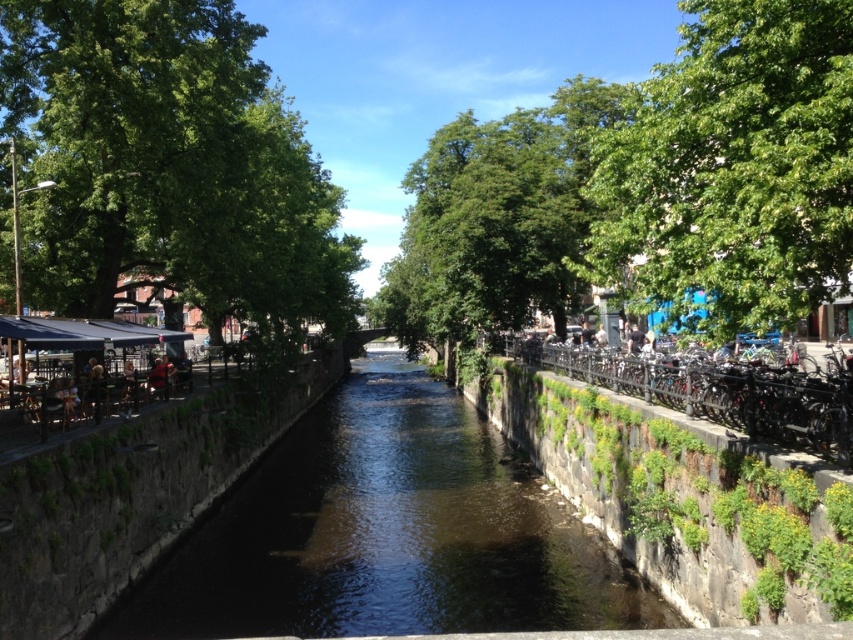
Which is more to the left, green leafy tree at left or green leafy tree at upper right?

green leafy tree at left is more to the left.

Is point (91, 106) positioned in front of point (616, 192)?

No, it is behind (616, 192).

Where is `green leafy tree at left`? Image resolution: width=853 pixels, height=640 pixels. green leafy tree at left is located at coordinates (167, 164).

Who is more forward, (444,572) or (616,262)?

Point (616,262)

Which is in front, point (167, 570) or point (804, 230)?

Point (804, 230)

Identify the location of dark stone river at center. [x=386, y=532].

Does point (88, 147) come closer to viewer compared to point (553, 528)?

No, it is not.

Does green leafy tree at left have a larger size compared to dark stone river at center?

Yes.

Identify the location of green leafy tree at left. The height and width of the screenshot is (640, 853). (167, 164).